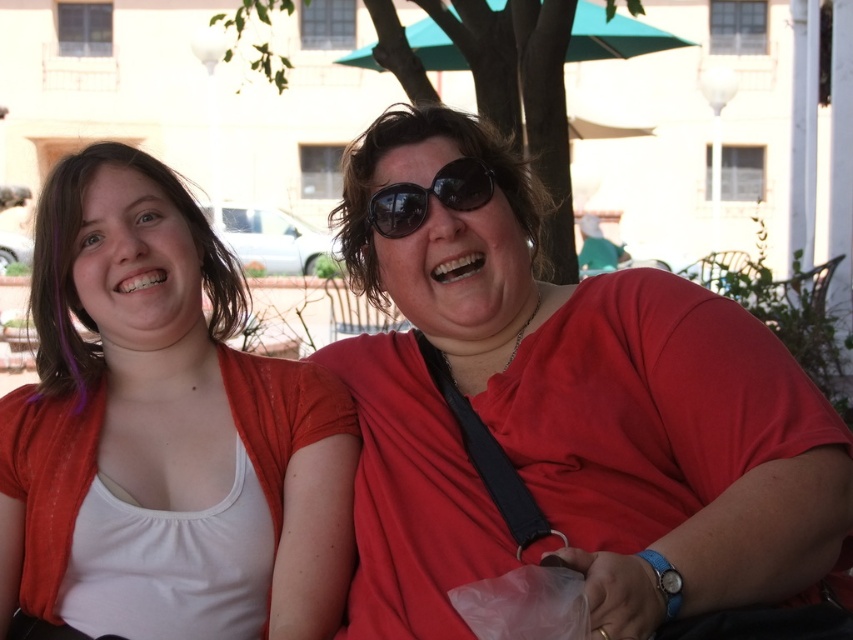
You are a delivery person needing to place a package between the matte red shirt at center and the teal fabric umbrella at upper center. The package requires a minimum of 40 feet of space. Can you fit it there?

The distance between the matte red shirt at center and the teal fabric umbrella at upper center is 44.07 feet, which exceeds the required 40 feet. Therefore, the package can be placed there with sufficient space.

You are standing at the camera position and want to walk towards the teal fabric umbrella at upper center. How many steps would you need to take if each step is about 2.5 feet?

The distance between the teal fabric umbrella at upper center and the camera is 55.50 feet. Dividing this by 2.5 feet per step gives 22.2 steps. Since you can only take whole steps, you would need to take approximately 22 steps to reach the teal fabric umbrella at upper center.